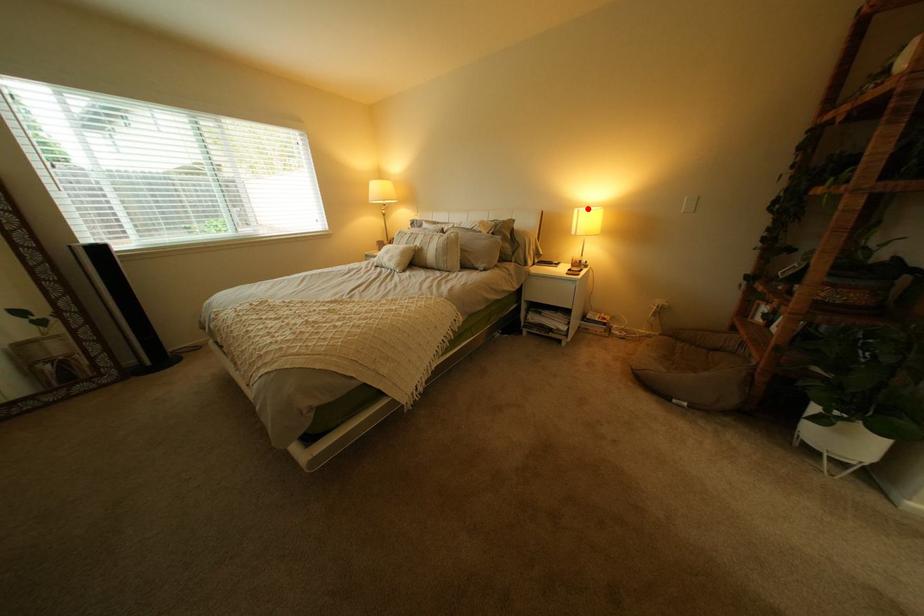
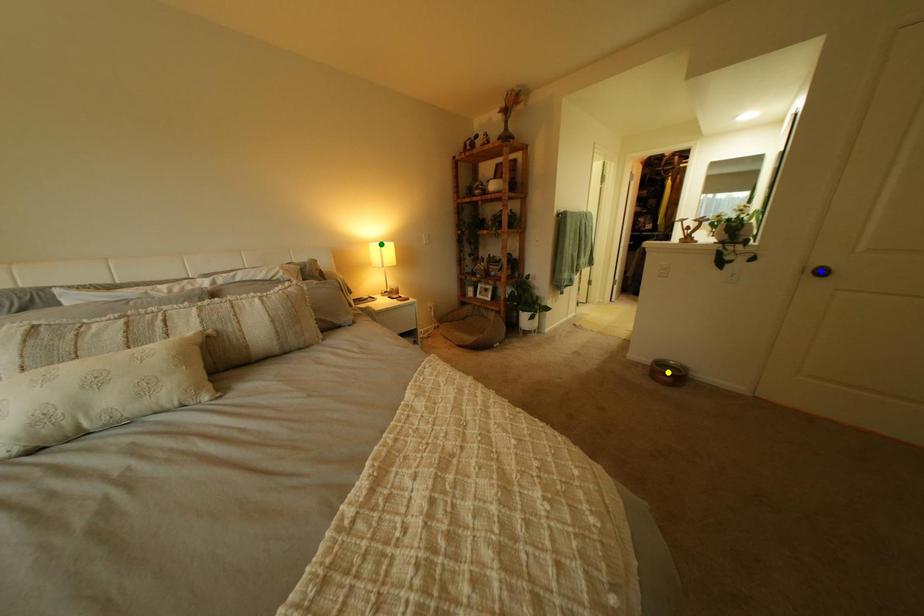
Question: I am providing you with two images of the same scene from different viewpoints. A red point is marked on the first image. You are given multiple points on the second image. Which spot in image 2 lines up with the point in image 1?

Choices:
 (A) green point
 (B) blue point
 (C) yellow point

Answer: (A)